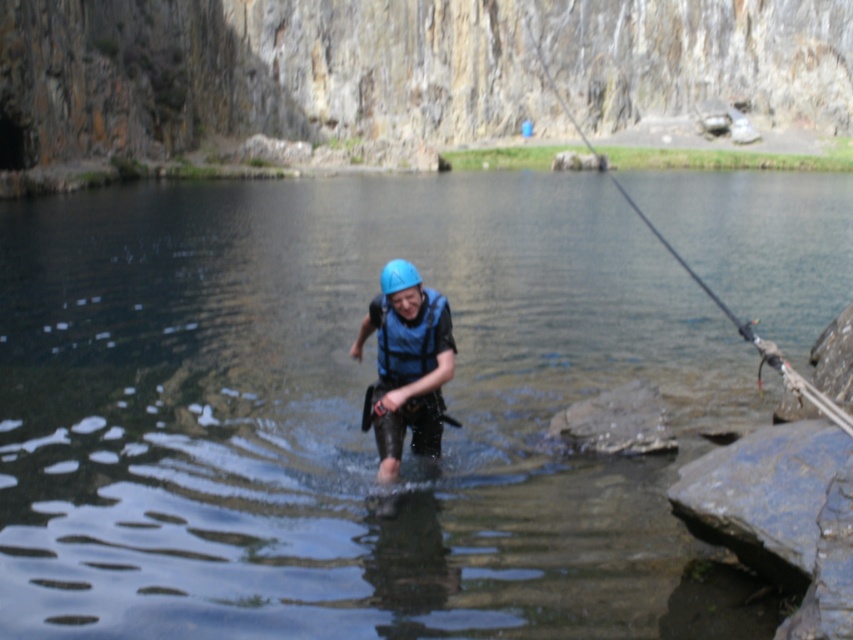
Question: Which point is farther from the camera taking this photo?

Choices:
 (A) (410, 273)
 (B) (675, 259)
 (C) (564, 400)
 (D) (418, 326)

Answer: (B)

Question: Which of the following is the farthest from the observer?

Choices:
 (A) (399, 260)
 (B) (428, 358)

Answer: (A)

Question: Which of the following is the closest to the observer?

Choices:
 (A) (399, 387)
 (B) (397, 260)
 (C) (379, 332)
 (D) (534, 572)

Answer: (D)

Question: Is blue matte safety vest at center below blue matte helmet at center?

Choices:
 (A) no
 (B) yes

Answer: (B)

Question: Is clear water at center below blue matte life vest at center?

Choices:
 (A) no
 (B) yes

Answer: (A)

Question: Can you confirm if blue matte life vest at center is thinner than black plastic fishing pole at right?

Choices:
 (A) yes
 (B) no

Answer: (A)